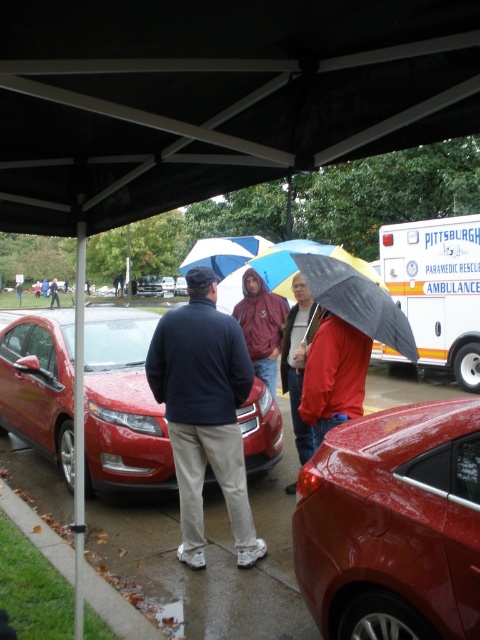
Between black matte canopy at upper center and glossy metallic car at lower right, which one has less height?

black matte canopy at upper center

Is black matte canopy at upper center below glossy metallic car at lower right?

Actually, black matte canopy at upper center is above glossy metallic car at lower right.

This screenshot has width=480, height=640. I want to click on black matte canopy at upper center, so click(x=215, y=97).

Between dark blue sweater at center and rainbow-patterned umbrella at center, which one has more height?

Standing taller between the two is rainbow-patterned umbrella at center.

This screenshot has width=480, height=640. What do you see at coordinates (204, 412) in the screenshot?
I see `dark blue sweater at center` at bounding box center [204, 412].

You are a GUI agent. You are given a task and a screenshot of the screen. Output one action in this format:
    pyautogui.click(x=<x>, y=<y>)
    Task: Click on the dark blue sweater at center
    
    Given the screenshot: What is the action you would take?
    pyautogui.click(x=204, y=412)

Is shiny red sedan at center closer to camera compared to red matte jacket at center?

That is True.

Identify the location of shiny red sedan at center. The image size is (480, 640). (122, 404).

The width and height of the screenshot is (480, 640). Find the location of `shiny red sedan at center`. shiny red sedan at center is located at coordinates (122, 404).